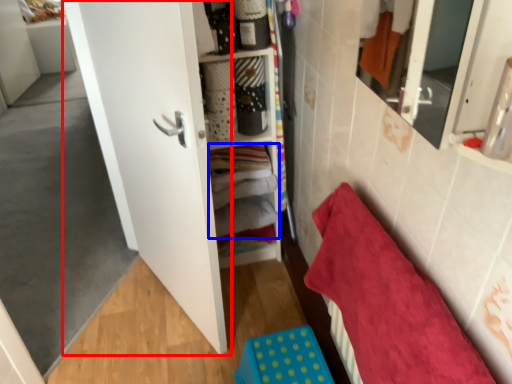
Question: Among these objects, which one is nearest to the camera, door (highlighted by a red box) or laundry (highlighted by a blue box)?

Choices:
 (A) door
 (B) laundry

Answer: (A)